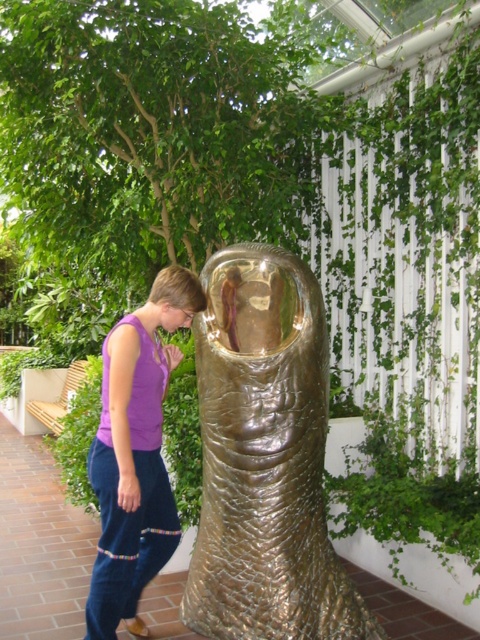
Question: Can you confirm if gold textured fish at center is positioned below purple cotton pants at lower left?

Choices:
 (A) yes
 (B) no

Answer: (B)

Question: Which point appears farthest from the camera in this image?

Choices:
 (A) (220, 627)
 (B) (93, 451)

Answer: (B)

Question: Which object appears closest to the camera in this image?

Choices:
 (A) purple cotton pants at lower left
 (B) gold textured fish at center

Answer: (B)

Question: Does gold textured fish at center lie behind purple cotton pants at lower left?

Choices:
 (A) no
 (B) yes

Answer: (A)

Question: Considering the relative positions of gold textured fish at center and purple cotton pants at lower left in the image provided, where is gold textured fish at center located with respect to purple cotton pants at lower left?

Choices:
 (A) left
 (B) right

Answer: (B)